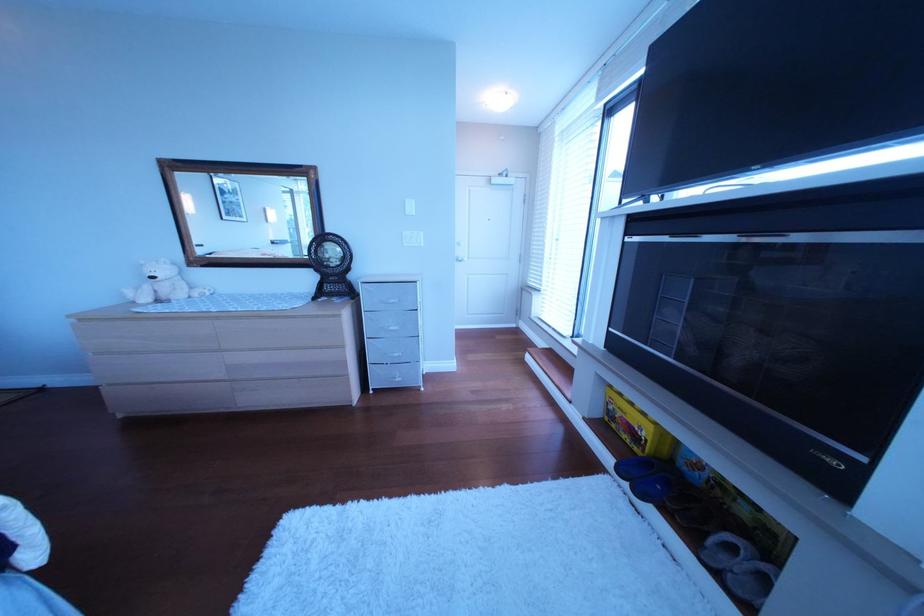
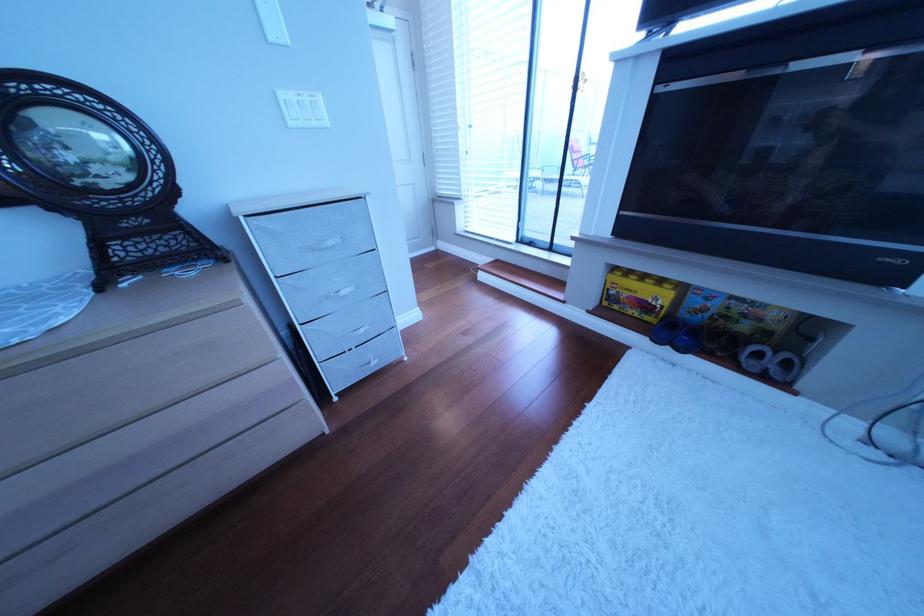
Where in the second image is the point corresponding to (x=635, y=416) from the first image?

(640, 296)